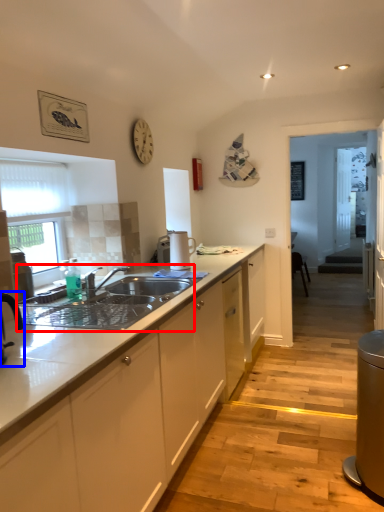
Question: Which point is further to the camera, sink (highlighted by a red box) or tap (highlighted by a blue box)?

Choices:
 (A) sink
 (B) tap

Answer: (A)